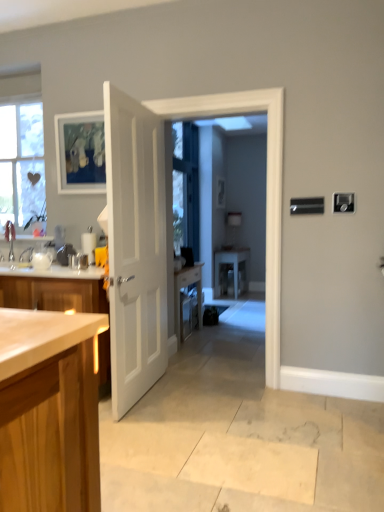
Identify the location of vacant point to the right of white matte door at center. (189, 404).